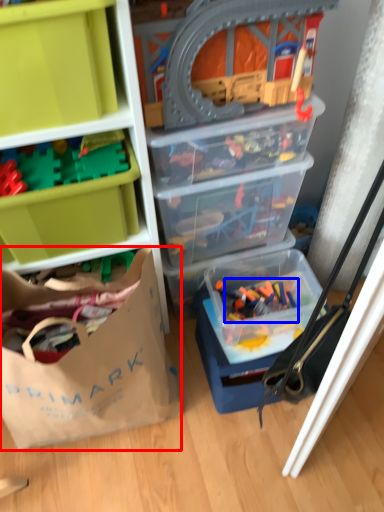
Question: Which object is further to the camera taking this photo, handbag (highlighted by a red box) or toy (highlighted by a blue box)?

Choices:
 (A) handbag
 (B) toy

Answer: (B)